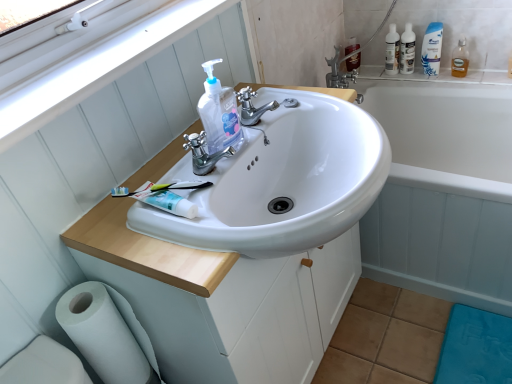
Locate an element on the screen. clear plastic bottle at upper right is located at coordinates (392, 51).

The image size is (512, 384). Describe the element at coordinates (432, 49) in the screenshot. I see `white glossy shampoo bottle at upper right, the first cleaning product when ordered from top to bottom` at that location.

The image size is (512, 384). What do you see at coordinates (460, 59) in the screenshot? I see `translucent plastic mouthwash at upper right, which is counted as the 1th mouthwash, starting from the right` at bounding box center [460, 59].

What do you see at coordinates (407, 50) in the screenshot? I see `clear plastic bottles at upper right, the second mouthwash positioned from the right` at bounding box center [407, 50].

The height and width of the screenshot is (384, 512). Describe the element at coordinates (252, 107) in the screenshot. I see `silver metallic faucet at center, the 2th tap when ordered from bottom to top` at that location.

The width and height of the screenshot is (512, 384). What do you see at coordinates (353, 62) in the screenshot?
I see `matte brown spray bottle at upper right, the second cleaning product when ordered from right to left` at bounding box center [353, 62].

Where is `clear plastic bottle at upper right`? The image size is (512, 384). clear plastic bottle at upper right is located at coordinates (392, 51).

Is clear plastic bottles at upper right, the 1th mouthwash in the left-to-right sequence, not within silver metallic faucet at center, arranged as the second tap when viewed from the front?

Yes, clear plastic bottles at upper right, the 1th mouthwash in the left-to-right sequence, is located beyond the bounds of silver metallic faucet at center, arranged as the second tap when viewed from the front.

Between clear plastic bottles at upper right, the second mouthwash positioned from the right, and silver metallic faucet at center, arranged as the first tap when viewed from the top, which one has smaller width?

With smaller width is clear plastic bottles at upper right, the second mouthwash positioned from the right.

Are clear plastic bottles at upper right, the second mouthwash positioned from the right, and silver metallic faucet at center, marked as the 2th tap in a left-to-right arrangement, far apart?

Yes, clear plastic bottles at upper right, the second mouthwash positioned from the right, and silver metallic faucet at center, marked as the 2th tap in a left-to-right arrangement, are located far from each other.

Consider the image. Is clear plastic bottles at upper right, the second mouthwash positioned from the right, to the left of silver metallic faucet at center, arranged as the second tap when viewed from the front, from the viewer's perspective?

No.

You are a GUI agent. You are given a task and a screenshot of the screen. Output one action in this format:
    pyautogui.click(x=<x>, y=<y>)
    Task: Click on the bathroom cabinet in front of the white plastic window frame at upper left
    
    Given the screenshot: What is the action you would take?
    pyautogui.click(x=222, y=298)

Which is more to the left, white glossy cabinet at center or white plastic window frame at upper left?

Positioned to the left is white plastic window frame at upper left.

Would you say white glossy cabinet at center is outside white plastic window frame at upper left?

Absolutely, white glossy cabinet at center is external to white plastic window frame at upper left.

From the image's perspective, does white glossy cabinet at center appear lower than white plastic window frame at upper left?

Yes, from the image's perspective, white glossy cabinet at center is beneath white plastic window frame at upper left.

Consider the image. Could you measure the distance between white plastic window frame at upper left and clear plastic bottle at upper right?

The distance of white plastic window frame at upper left from clear plastic bottle at upper right is 4.08 feet.

Would you say white plastic window frame at upper left is a long distance from clear plastic bottle at upper right?

Absolutely, white plastic window frame at upper left is distant from clear plastic bottle at upper right.

Is white plastic window frame at upper left bigger than clear plastic bottle at upper right?

Yes.

Based on the photo, relative to clear plastic bottle at upper right, is white plastic window frame at upper left in front or behind?

Clearly, white plastic window frame at upper left is in front of clear plastic bottle at upper right.

How distant is white glossy shampoo bottle at upper right, the second cleaning product viewed from the back, from silver metallic faucet at center, which is the first tap in back-to-front order?

white glossy shampoo bottle at upper right, the second cleaning product viewed from the back, and silver metallic faucet at center, which is the first tap in back-to-front order, are 3.47 feet apart from each other.

Based on the photo, from a real-world perspective, between white glossy shampoo bottle at upper right, the first cleaning product when ordered from top to bottom, and silver metallic faucet at center, which is the first tap in back-to-front order, who is vertically lower?

white glossy shampoo bottle at upper right, the first cleaning product when ordered from top to bottom, from a real-world perspective.

What's the angular difference between white glossy shampoo bottle at upper right, the 2th cleaning product in the front-to-back sequence, and silver metallic faucet at center, the 2th tap when ordered from bottom to top,'s facing directions?

The angular difference between white glossy shampoo bottle at upper right, the 2th cleaning product in the front-to-back sequence, and silver metallic faucet at center, the 2th tap when ordered from bottom to top, is 89.9 degrees.

Between point (431, 26) and point (253, 109), which one is positioned behind?

The point (431, 26) is more distant.

Does translucent plastic mouthwash at upper right, which is counted as the 1th mouthwash, starting from the right, have a lesser width compared to white glossy bathtub at upper right?

Yes, translucent plastic mouthwash at upper right, which is counted as the 1th mouthwash, starting from the right, is thinner than white glossy bathtub at upper right.

From the image's perspective, is translucent plastic mouthwash at upper right, the second mouthwash positioned from the left, over white glossy bathtub at upper right?

Yes, from the image's perspective, translucent plastic mouthwash at upper right, the second mouthwash positioned from the left, is over white glossy bathtub at upper right.

Does translucent plastic mouthwash at upper right, which is counted as the 1th mouthwash, starting from the right, lie behind white glossy bathtub at upper right?

Yes, translucent plastic mouthwash at upper right, which is counted as the 1th mouthwash, starting from the right, is further from the camera.

Can you confirm if translucent plastic mouthwash at upper right, which is counted as the 1th mouthwash, starting from the right, is bigger than white glossy bathtub at upper right?

Actually, translucent plastic mouthwash at upper right, which is counted as the 1th mouthwash, starting from the right, might be smaller than white glossy bathtub at upper right.

Considering the relative sizes of clear plastic bottles at upper right, the 1th mouthwash in the left-to-right sequence, and translucent plastic mouthwash at upper right, the second mouthwash positioned from the left, in the image provided, is clear plastic bottles at upper right, the 1th mouthwash in the left-to-right sequence, taller than translucent plastic mouthwash at upper right, the second mouthwash positioned from the left,?

Indeed, clear plastic bottles at upper right, the 1th mouthwash in the left-to-right sequence, has a greater height compared to translucent plastic mouthwash at upper right, the second mouthwash positioned from the left.

Which of these two, clear plastic bottles at upper right, the second mouthwash positioned from the right, or translucent plastic mouthwash at upper right, the second mouthwash positioned from the left, is wider?

translucent plastic mouthwash at upper right, the second mouthwash positioned from the left, is wider.

Is clear plastic bottles at upper right, the 1th mouthwash in the left-to-right sequence, further to the viewer compared to translucent plastic mouthwash at upper right, which is counted as the 1th mouthwash, starting from the right?

Yes, the depth of clear plastic bottles at upper right, the 1th mouthwash in the left-to-right sequence, is greater than that of translucent plastic mouthwash at upper right, which is counted as the 1th mouthwash, starting from the right.

From a real-world perspective, which object stands above the other?

clear plastic bottles at upper right, the second mouthwash positioned from the right.

Between translucent plastic mouthwash at upper right, the second mouthwash positioned from the left, and white matte toilet paper at lower left, which one has less height?

Standing shorter between the two is translucent plastic mouthwash at upper right, the second mouthwash positioned from the left.

Considering the relative positions of translucent plastic mouthwash at upper right, the second mouthwash positioned from the left, and white matte toilet paper at lower left in the image provided, is translucent plastic mouthwash at upper right, the second mouthwash positioned from the left, behind white matte toilet paper at lower left?

Yes, it is.

Is translucent plastic mouthwash at upper right, the second mouthwash positioned from the left, wider than white matte toilet paper at lower left?

No.

How different are the orientations of translucent plastic mouthwash at upper right, the second mouthwash positioned from the left, and white matte toilet paper at lower left in degrees?

The angular difference between translucent plastic mouthwash at upper right, the second mouthwash positioned from the left, and white matte toilet paper at lower left is 90.2 degrees.

This screenshot has width=512, height=384. In order to click on the 1st tap below the clear plastic bottles at upper right, the second mouthwash positioned from the right (from the image's perspective) in this screenshot , I will do `click(252, 107)`.

Locate an element on the screen. The width and height of the screenshot is (512, 384). window frame above the white glossy cabinet at center (from the image's perspective) is located at coordinates (99, 68).

Estimate the real-world distances between objects in this image. Which object is further from white glossy bathtub at upper right, silver metallic faucet at center, marked as the 2th tap in a left-to-right arrangement, or white glossy toothpaste at center?

white glossy toothpaste at center.

Which object lies nearer to the anchor point silver metallic faucet at center, marked as the 2th tap in a left-to-right arrangement, white matte toilet paper at lower left or white glossy toothpaste at center?

white glossy toothpaste at center is positioned closer to the anchor silver metallic faucet at center, marked as the 2th tap in a left-to-right arrangement.

Looking at the image, which one is located closer to matte brown spray bottle at upper right, placed as the second cleaning product when sorted from top to bottom, white matte toilet paper at lower left or white glossy toothpaste at center?

Based on the image, white glossy toothpaste at center appears to be nearer to matte brown spray bottle at upper right, placed as the second cleaning product when sorted from top to bottom.

Looking at the image, which one is located closer to white glossy shampoo bottle at upper right, the 1th cleaning product viewed from the right, white glossy toothpaste at center or white matte toilet paper at lower left?

Among the two, white glossy toothpaste at center is located nearer to white glossy shampoo bottle at upper right, the 1th cleaning product viewed from the right.

Which object lies nearer to the anchor point clear plastic bottles at upper right, the 1th mouthwash in the left-to-right sequence, polished chrome faucet at center, the first tap positioned from the left, or white glossy bathtub at upper right?

Based on the image, white glossy bathtub at upper right appears to be nearer to clear plastic bottles at upper right, the 1th mouthwash in the left-to-right sequence.

Which object lies nearer to the anchor point white plastic window frame at upper left, polished chrome faucet at center, positioned as the second tap in right-to-left order, or white matte toilet paper at lower left?

polished chrome faucet at center, positioned as the second tap in right-to-left order.

When comparing their distances from clear plastic bottles at upper right, the second mouthwash positioned from the right, does polished chrome faucet at center, positioned as the second tap in right-to-left order, or white matte toilet paper at lower left seem closer?

polished chrome faucet at center, positioned as the second tap in right-to-left order, is positioned closer to the anchor clear plastic bottles at upper right, the second mouthwash positioned from the right.

Looking at the image, which one is located closer to polished chrome faucet at center, which is the first tap in bottom-to-top order, clear plastic bottle at upper right or white glossy bathtub at upper right?

Based on the image, white glossy bathtub at upper right appears to be nearer to polished chrome faucet at center, which is the first tap in bottom-to-top order.

Locate an element on the screen. toiletry located between white glossy cabinet at center and matte brown spray bottle at upper right, the second cleaning product when ordered from right to left, in the depth direction is located at coordinates (392, 51).

Identify the location of tap situated between white plastic window frame at upper left and silver metallic faucet at center, arranged as the first tap when viewed from the top, from left to right. (203, 153).

Where is `bath between white glossy cabinet at center and white glossy shampoo bottle at upper right, which is counted as the third cleaning product, starting from the left, along the z-axis`? bath between white glossy cabinet at center and white glossy shampoo bottle at upper right, which is counted as the third cleaning product, starting from the left, along the z-axis is located at coordinates (443, 187).

At what (x,y) coordinates should I click in order to perform the action: click on tap located between polished chrome faucet at center, positioned as the second tap in right-to-left order, and clear plastic bottles at upper right, the second mouthwash positioned from the right, in the depth direction. Please return your answer as a coordinate pair (x, y). Looking at the image, I should click on (252, 107).